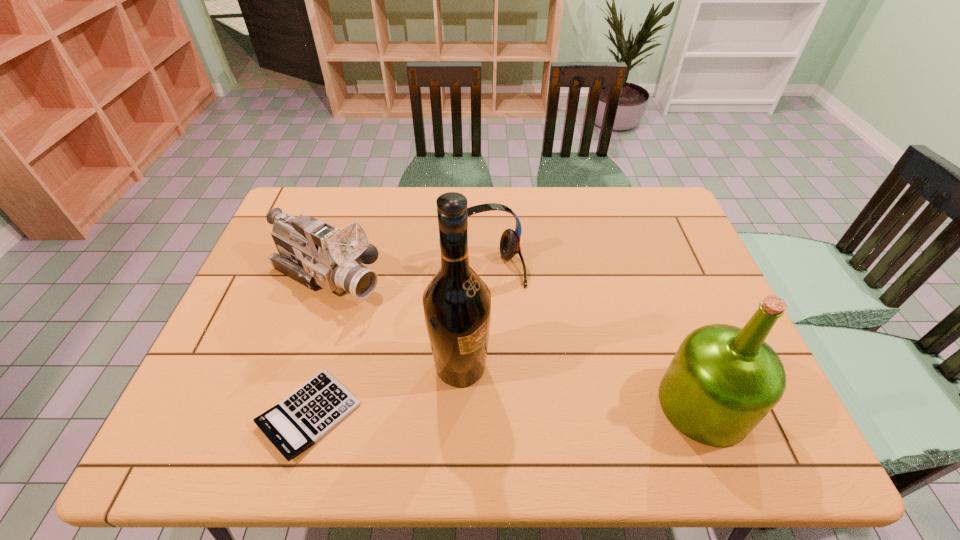
You are a GUI agent. You are given a task and a screenshot of the screen. Output one action in this format:
    pyautogui.click(x=<x>, y=<y>)
    Task: Click on the free point at the far edge
    This screenshot has height=540, width=960.
    Given the screenshot: What is the action you would take?
    pos(503,204)

This screenshot has width=960, height=540. Find the location of `vacant point at the near edge`. vacant point at the near edge is located at coordinates (350, 380).

I want to click on vacant space at the right edge of the desktop, so click(698, 285).

The height and width of the screenshot is (540, 960). I want to click on vacant region at the far left corner of the desktop, so click(x=337, y=189).

Where is `blank space at the far right corner of the desktop`? The image size is (960, 540). blank space at the far right corner of the desktop is located at coordinates (673, 218).

The height and width of the screenshot is (540, 960). Find the location of `blank region between the calculator and the rightmost object`. blank region between the calculator and the rightmost object is located at coordinates (507, 409).

Identify the location of free area in between the rightmost object and the camcorder. This screenshot has height=540, width=960. (516, 341).

Where is `empty space that is in between the olive oil and the calculator`? The height and width of the screenshot is (540, 960). empty space that is in between the olive oil and the calculator is located at coordinates (507, 409).

Where is `vacant space that's between the shortest object and the tallest object`? The height and width of the screenshot is (540, 960). vacant space that's between the shortest object and the tallest object is located at coordinates (385, 390).

Locate an element on the screen. blank region between the headset and the camcorder is located at coordinates (406, 273).